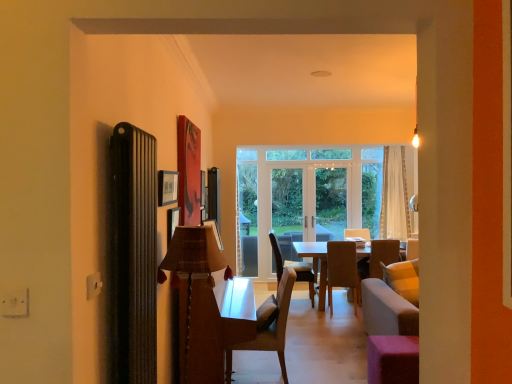
Question: Based on their sizes in the image, would you say clear glass door at center, arranged as the 1th screen door when viewed from the right, is bigger or smaller than white sheer curtain at center?

Choices:
 (A) big
 (B) small

Answer: (A)

Question: Considering the relative positions of clear glass door at center, the second screen door when ordered from left to right, and white sheer curtain at center in the image provided, is clear glass door at center, the second screen door when ordered from left to right, to the left or to the right of white sheer curtain at center?

Choices:
 (A) left
 (B) right

Answer: (A)

Question: Which is farther from the white glossy screen door at center, the 2th screen door viewed from the right?

Choices:
 (A) brown leather chair at center, which ranks as the 3th chair in front-to-back order
 (B) plaid fabric lampshade at center
 (C) light brown fabric chair at center, which ranks as the 2th chair in front-to-back order
 (D) pink fabric stool at lower right
 (E) white sheer curtain at center

Answer: (B)

Question: Which is farther from the light brown fabric chair at center, which ranks as the 2th chair in front-to-back order?

Choices:
 (A) brown leather chair at center, arranged as the 1th chair when viewed from the back
 (B) light brown wooden chair at center, which ranks as the 1th chair in front-to-back order
 (C) pink fabric stool at lower right
 (D) white sheer curtain at center
 (E) plaid fabric lampshade at center

Answer: (E)